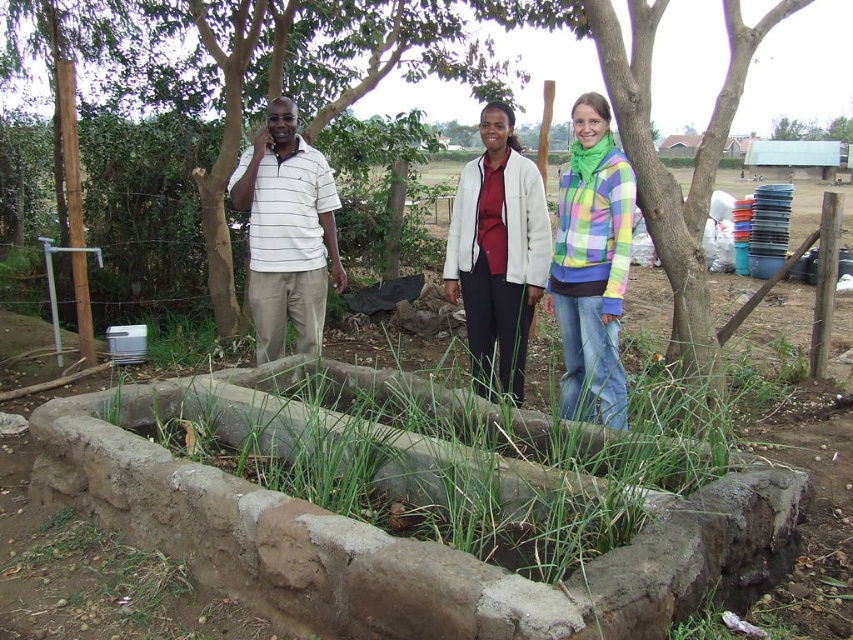
Who is lower down, brown bark tree at upper center or white striped polo shirt at left?

white striped polo shirt at left is lower down.

Between point (190, 92) and point (247, 204), which one is positioned in front?

Point (247, 204)

Who is more distant from viewer, (254, 56) or (276, 108)?

The point (254, 56) is behind.

You are a GUI agent. You are given a task and a screenshot of the screen. Output one action in this format:
    pyautogui.click(x=<x>, y=<y>)
    Task: Click on the brown bark tree at upper center
    The width and height of the screenshot is (853, 640).
    Given the screenshot: What is the action you would take?
    pyautogui.click(x=273, y=65)

Between multicolored plaid jacket at center and white striped polo shirt at left, which one is positioned lower?

multicolored plaid jacket at center

What do you see at coordinates (592, 266) in the screenshot? I see `multicolored plaid jacket at center` at bounding box center [592, 266].

Does point (604, 360) come behind point (280, 298)?

That is False.

Locate an element on the screen. The height and width of the screenshot is (640, 853). multicolored plaid jacket at center is located at coordinates (592, 266).

Who is shorter, brown bark tree at upper center or white fleece jacket at center?

With less height is brown bark tree at upper center.

Find the location of `brown bark tree at upper center`. brown bark tree at upper center is located at coordinates (273, 65).

Where is `brown bark tree at upper center`? brown bark tree at upper center is located at coordinates (273, 65).